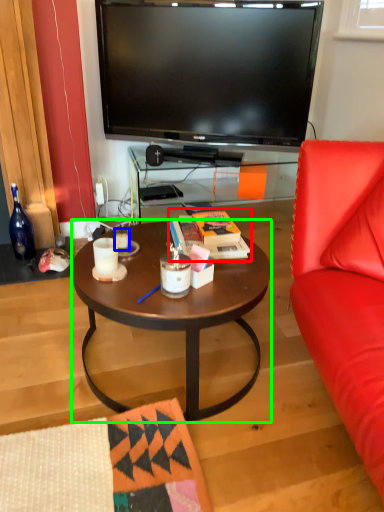
Question: Based on their relative distances, which object is nearer to magazine (highlighted by a red box)? Choose from coffee cup (highlighted by a blue box) and coffee table (highlighted by a green box).

Choices:
 (A) coffee cup
 (B) coffee table

Answer: (B)